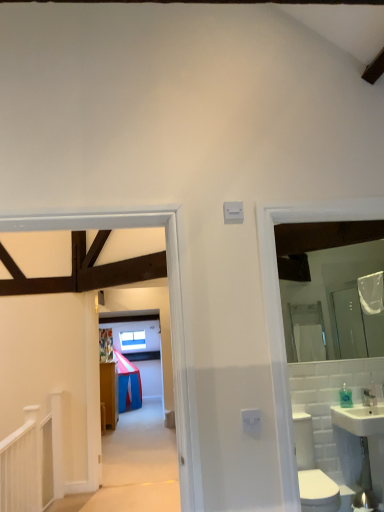
What do you see at coordinates (317, 243) in the screenshot? The image size is (384, 512). I see `clear glass mirror at right` at bounding box center [317, 243].

Describe the element at coordinates (345, 397) in the screenshot. The width and height of the screenshot is (384, 512). I see `clear plastic bottle at right` at that location.

In order to face white ceramic sink at right, should I rotate leftwards or rightwards?

Rotate your view right by about 23.778°.

This screenshot has height=512, width=384. What do you see at coordinates (169, 303) in the screenshot?
I see `wooden floorboards at center` at bounding box center [169, 303].

Image resolution: width=384 pixels, height=512 pixels. Identify the location of clear glass mirror at right. (317, 243).

From the image's perspective, is white glossy toilet bowl at lower right beneath wooden floorboards at center?

Indeed, from the image's perspective, white glossy toilet bowl at lower right is shown beneath wooden floorboards at center.

Is white glossy toilet bowl at lower right oriented towards wooden floorboards at center?

No, white glossy toilet bowl at lower right is not turned towards wooden floorboards at center.

From a real-world perspective, is white glossy toilet bowl at lower right on top of wooden floorboards at center?

No, from a real-world perspective, white glossy toilet bowl at lower right is not over wooden floorboards at center

Does white glossy toilet bowl at lower right have a lesser width compared to wooden floorboards at center?

In fact, white glossy toilet bowl at lower right might be wider than wooden floorboards at center.

Does white ceramic sink at right have a lesser width compared to wooden floorboards at center?

In fact, white ceramic sink at right might be wider than wooden floorboards at center.

Is white ceramic sink at right surrounding wooden floorboards at center?

That's incorrect, wooden floorboards at center is not inside white ceramic sink at right.

Is white ceramic sink at right looking in the opposite direction of wooden floorboards at center?

No, white ceramic sink at right is not facing away from wooden floorboards at center.

Can you tell me how much white ceramic sink at right and wooden floorboards at center differ in facing direction?

The angle between the facing direction of white ceramic sink at right and the facing direction of wooden floorboards at center is 0.387 degrees.

Is transparent glass window at upper center directly adjacent to wooden floorboards at center?

They are not placed beside each other.

Considering the points (129, 346) and (91, 379), which point is behind, point (129, 346) or point (91, 379)?

The point (129, 346) is farther.

Looking at this image, from the image's perspective, is transparent glass window at upper center located beneath wooden floorboards at center?

Yes, from the image's perspective, transparent glass window at upper center is below wooden floorboards at center.

Considering their positions, is white glossy toilet bowl at lower right located in front of or behind white ceramic sink at right?

Visually, white glossy toilet bowl at lower right is located in front of white ceramic sink at right.

Could you tell me if white glossy toilet bowl at lower right is facing white ceramic sink at right?

No, white glossy toilet bowl at lower right is not turned towards white ceramic sink at right.

Locate an element on the screen. The height and width of the screenshot is (512, 384). toilet bowl below the white ceramic sink at right (from a real-world perspective) is located at coordinates (312, 471).

How many degrees apart are the facing directions of white ceramic sink at right and white glossy toilet bowl at lower right?

The angle between the facing direction of white ceramic sink at right and the facing direction of white glossy toilet bowl at lower right is 1.05 degrees.

Locate an element on the screen. The height and width of the screenshot is (512, 384). sink behind the white glossy toilet bowl at lower right is located at coordinates (361, 446).

From the image's perspective, which object appears higher, white ceramic sink at right or white glossy toilet bowl at lower right?

white ceramic sink at right, from the image's perspective.

Which object is more forward, white ceramic sink at right or white glossy toilet bowl at lower right?

white glossy toilet bowl at lower right is more forward.

Is clear plastic bottle at right facing away from clear glass mirror at right?

No, clear plastic bottle at right's orientation is not away from clear glass mirror at right.

From the image's perspective, would you say clear plastic bottle at right is positioned over clear glass mirror at right?

No, from the image's perspective, clear plastic bottle at right is not on top of clear glass mirror at right.

How far apart are clear plastic bottle at right and clear glass mirror at right?

A distance of 1.28 meters exists between clear plastic bottle at right and clear glass mirror at right.

Does clear plastic bottle at right touch clear glass mirror at right?

No, clear plastic bottle at right is not touching clear glass mirror at right.

Which object is wider, transparent glass window at upper center or white ceramic sink at right?

transparent glass window at upper center.

In the scene shown: Is transparent glass window at upper center positioned beyond the bounds of white ceramic sink at right?

transparent glass window at upper center lies outside white ceramic sink at right's area.

What's the angular difference between transparent glass window at upper center and white ceramic sink at right's facing directions?

The facing directions of transparent glass window at upper center and white ceramic sink at right are 4.83 degrees apart.

Where is `corridor that is on the left side of white glossy toilet bowl at lower right`? corridor that is on the left side of white glossy toilet bowl at lower right is located at coordinates (169, 303).

You are a GUI agent. You are given a task and a screenshot of the screen. Output one action in this format:
    pyautogui.click(x=<x>, y=<y>)
    Task: Click on the sink that is behind the wooden floorboards at center
    
    Given the screenshot: What is the action you would take?
    pyautogui.click(x=361, y=446)

From the image, which object appears to be nearer to clear glass mirror at right, wooden floorboards at center or clear plastic bottle at right?

clear plastic bottle at right lies closer to clear glass mirror at right than the other object.

Looking at the image, which one is located closer to clear plastic bottle at right, transparent glass window at upper center or wooden floorboards at center?

Based on the image, wooden floorboards at center appears to be nearer to clear plastic bottle at right.

When comparing their distances from white ceramic sink at right, does clear plastic bottle at right or white glossy toilet bowl at lower right seem further?

white glossy toilet bowl at lower right lies further to white ceramic sink at right than the other object.

Based on their spatial positions, is wooden floorboards at center or white ceramic sink at right closer to white glossy toilet bowl at lower right?

Based on the image, white ceramic sink at right appears to be nearer to white glossy toilet bowl at lower right.

Estimate the real-world distances between objects in this image. Which object is further from wooden floorboards at center, clear glass mirror at right or white glossy toilet bowl at lower right?

white glossy toilet bowl at lower right.

Looking at the image, which one is located closer to white ceramic sink at right, clear plastic bottle at right or transparent glass window at upper center?

clear plastic bottle at right is positioned closer to the anchor white ceramic sink at right.

Considering their positions, is clear glass mirror at right positioned further to white glossy toilet bowl at lower right than clear plastic bottle at right?

clear glass mirror at right.

Looking at the image, which one is located further to transparent glass window at upper center, white ceramic sink at right or wooden floorboards at center?

Based on the image, wooden floorboards at center appears to be further to transparent glass window at upper center.

Locate an element on the screen. mirror positioned between wooden floorboards at center and transparent glass window at upper center from near to far is located at coordinates [317, 243].

At what (x,y) coordinates should I click in order to perform the action: click on toiletry between clear glass mirror at right and white ceramic sink at right vertically. Please return your answer as a coordinate pair (x, y). Looking at the image, I should click on (345, 397).

Locate an element on the screen. sink between white glossy toilet bowl at lower right and transparent glass window at upper center along the z-axis is located at coordinates (361, 446).

Locate an element on the screen. The width and height of the screenshot is (384, 512). mirror between white glossy toilet bowl at lower right and transparent glass window at upper center in the front-back direction is located at coordinates (317, 243).